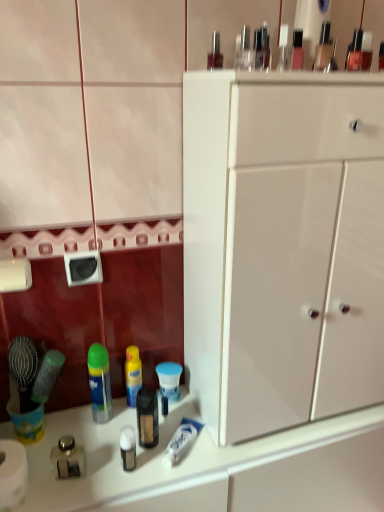
Identify the location of free spot behind clear glass jar at lower left, which appears as the first toiletry when ordered from the bottom. (79, 429).